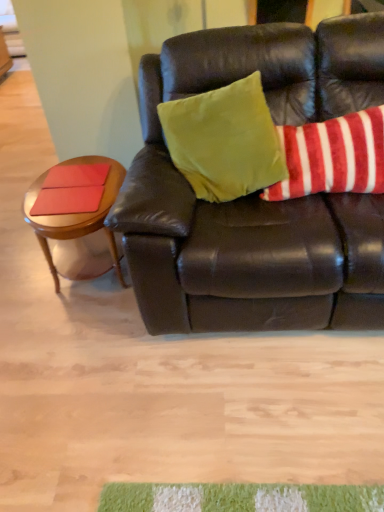
Measure the distance between matte red pad at left, the second pad from the bottom, and camera.

A distance of 6.28 feet exists between matte red pad at left, the second pad from the bottom, and camera.

What is the approximate width of matte brown leather couch at center?

matte brown leather couch at center is 1.05 meters in width.

What do you see at coordinates (225, 140) in the screenshot? This screenshot has height=512, width=384. I see `velvety green pillow at upper center, which is the first pillow in left-to-right order` at bounding box center [225, 140].

From the picture: What is the approximate width of woodenwoodentable at left?

woodenwoodentable at left is 18.40 inches wide.

Locate an element on the screen. Image resolution: width=384 pixels, height=512 pixels. matte red pad at left, the first pad positioned from the top is located at coordinates (76, 175).

From the image's perspective, is velvety green pillow at upper center, arranged as the second pillow when viewed from the right, over woodenwoodentable at left?

Indeed, from the image's perspective, velvety green pillow at upper center, arranged as the second pillow when viewed from the right, is shown above woodenwoodentable at left.

In terms of height, does velvety green pillow at upper center, arranged as the second pillow when viewed from the right, look taller or shorter compared to woodenwoodentable at left?

Considering their sizes, velvety green pillow at upper center, arranged as the second pillow when viewed from the right, has more height than woodenwoodentable at left.

Is the position of velvety green pillow at upper center, which is the first pillow in left-to-right order, less distant than that of woodenwoodentable at left?

Yes, velvety green pillow at upper center, which is the first pillow in left-to-right order, is closer to the camera.

From the image's perspective, which is above, velvety green pillow at upper center, arranged as the second pillow when viewed from the right, or matte red pad at left, the first pad positioned from the top?

velvety green pillow at upper center, arranged as the second pillow when viewed from the right, from the image's perspective.

Would you say velvety green pillow at upper center, which is the first pillow in left-to-right order, contains matte red pad at left, the second pad from the bottom?

No, matte red pad at left, the second pad from the bottom, is not inside velvety green pillow at upper center, which is the first pillow in left-to-right order.

The image size is (384, 512). I want to click on pillow that is the 2nd one when counting forward from the matte red pad at left, the first pad in the back-to-front sequence, so pos(225,140).

Is velvety green pillow at upper center, which is the first pillow in left-to-right order, positioned with its back to matte red pad at left, the second pad from the bottom?

No, velvety green pillow at upper center, which is the first pillow in left-to-right order, is not facing the opposite direction of matte red pad at left, the second pad from the bottom.

Who is shorter, matte red pad at left, the second pad viewed from the back, or matte red pad at left, which ranks as the second pad in front-to-back order?

Standing shorter between the two is matte red pad at left, which ranks as the second pad in front-to-back order.

Where is `pad behind the matte red pad at left, marked as the 1th pad in a bottom-to-top arrangement`? The width and height of the screenshot is (384, 512). pad behind the matte red pad at left, marked as the 1th pad in a bottom-to-top arrangement is located at coordinates (76, 175).

Is matte red pad at left, marked as the 1th pad in a bottom-to-top arrangement, wider than matte red pad at left, the second pad from the bottom?

Indeed, matte red pad at left, marked as the 1th pad in a bottom-to-top arrangement, has a greater width compared to matte red pad at left, the second pad from the bottom.

Is matte red pad at left, placed as the 1th pad when sorted from front to back, smaller than matte red pad at left, which ranks as the second pad in front-to-back order?

Actually, matte red pad at left, placed as the 1th pad when sorted from front to back, might be larger than matte red pad at left, which ranks as the second pad in front-to-back order.

In the scene shown: Is red/white striped pillow at upper right, the 1th pillow when ordered from right to left, placed right next to velvety green pillow at upper center, which is the first pillow in left-to-right order?

No, red/white striped pillow at upper right, the 1th pillow when ordered from right to left, is not next to velvety green pillow at upper center, which is the first pillow in left-to-right order.

Does point (340, 174) appear closer or farther from the camera than point (230, 186)?

Point (340, 174) is positioned closer to the camera compared to point (230, 186).

Considering the positions of objects red/white striped pillow at upper right, the 1th pillow when ordered from right to left, and velvety green pillow at upper center, which is the first pillow in left-to-right order, in the image provided, who is in front, red/white striped pillow at upper right, the 1th pillow when ordered from right to left, or velvety green pillow at upper center, which is the first pillow in left-to-right order,?

velvety green pillow at upper center, which is the first pillow in left-to-right order.

Could you tell me if matte red pad at left, placed as the 1th pad when sorted from front to back, is facing matte brown leather couch at center?

No, matte red pad at left, placed as the 1th pad when sorted from front to back, is not oriented towards matte brown leather couch at center.

Are matte red pad at left, placed as the 2th pad when sorted from top to bottom, and matte brown leather couch at center far apart?

No, matte red pad at left, placed as the 2th pad when sorted from top to bottom, is not far from matte brown leather couch at center.

From their relative heights in the image, would you say matte red pad at left, marked as the 1th pad in a bottom-to-top arrangement, is taller or shorter than matte brown leather couch at center?

matte red pad at left, marked as the 1th pad in a bottom-to-top arrangement, is shorter than matte brown leather couch at center.

Considering the relative positions of matte red pad at left, marked as the 1th pad in a bottom-to-top arrangement, and matte brown leather couch at center in the image provided, is matte red pad at left, marked as the 1th pad in a bottom-to-top arrangement, to the right of matte brown leather couch at center from the viewer's perspective?

In fact, matte red pad at left, marked as the 1th pad in a bottom-to-top arrangement, is to the left of matte brown leather couch at center.

Is red/white striped pillow at upper right, the second pillow when ordered from left to right, directly adjacent to matte brown leather couch at center?

red/white striped pillow at upper right, the second pillow when ordered from left to right, and matte brown leather couch at center are not in contact.

Based on the photo, considering the positions of objects red/white striped pillow at upper right, the 1th pillow when ordered from right to left, and matte brown leather couch at center in the image provided, who is more to the right, red/white striped pillow at upper right, the 1th pillow when ordered from right to left, or matte brown leather couch at center?

red/white striped pillow at upper right, the 1th pillow when ordered from right to left.

Image resolution: width=384 pixels, height=512 pixels. Identify the location of pillow on the right of matte brown leather couch at center. (333, 156).

From a real-world perspective, is red/white striped pillow at upper right, the second pillow when ordered from left to right, physically below matte brown leather couch at center?

Incorrect, from a real-world perspective, red/white striped pillow at upper right, the second pillow when ordered from left to right, is higher than matte brown leather couch at center.

Which object is positioned more to the right, matte brown leather couch at center or matte red pad at left, placed as the 1th pad when sorted from front to back?

From the viewer's perspective, matte brown leather couch at center appears more on the right side.

Is matte brown leather couch at center facing away from matte red pad at left, marked as the 1th pad in a bottom-to-top arrangement?

matte brown leather couch at center is not turned away from matte red pad at left, marked as the 1th pad in a bottom-to-top arrangement.

Does matte brown leather couch at center touch matte red pad at left, placed as the 1th pad when sorted from front to back?

There is a gap between matte brown leather couch at center and matte red pad at left, placed as the 1th pad when sorted from front to back.

At what (x,y) coordinates should I click in order to perform the action: click on studio couch on the right of matte red pad at left, placed as the 2th pad when sorted from top to bottom. Please return your answer as a coordinate pair (x, y). This screenshot has width=384, height=512. Looking at the image, I should click on (256, 193).

Which pillow is the 2nd one when counting from the front of the woodenwoodentable at left? Please provide its 2D coordinates.

[(225, 140)]

The height and width of the screenshot is (512, 384). Identify the location of pad that is the 1st one below the velvety green pillow at upper center, which is the first pillow in left-to-right order (from a real-world perspective). (76, 175).

From the image, which object appears to be farther from matte red pad at left, the first pad positioned from the top, woodenwoodentable at left or matte brown leather couch at center?

matte brown leather couch at center is positioned further to the anchor matte red pad at left, the first pad positioned from the top.

Based on their spatial positions, is matte red pad at left, the first pad in the back-to-front sequence, or matte brown leather couch at center further from woodenwoodentable at left?

matte brown leather couch at center is further to woodenwoodentable at left.

When comparing their distances from woodenwoodentable at left, does velvety green pillow at upper center, which is the first pillow in left-to-right order, or red/white striped pillow at upper right, the 1th pillow when ordered from right to left, seem closer?

Result: The object closer to woodenwoodentable at left is velvety green pillow at upper center, which is the first pillow in left-to-right order.

From the image, which object appears to be farther from matte brown leather couch at center, matte red pad at left, marked as the 1th pad in a bottom-to-top arrangement, or matte red pad at left, which ranks as the second pad in front-to-back order?

matte red pad at left, which ranks as the second pad in front-to-back order, is further to matte brown leather couch at center.

When comparing their distances from velvety green pillow at upper center, arranged as the second pillow when viewed from the right, does matte red pad at left, marked as the 1th pad in a bottom-to-top arrangement, or matte red pad at left, the second pad from the bottom, seem further?

The object further to velvety green pillow at upper center, arranged as the second pillow when viewed from the right, is matte red pad at left, the second pad from the bottom.

Considering their positions, is velvety green pillow at upper center, arranged as the second pillow when viewed from the right, positioned further to matte red pad at left, marked as the 1th pad in a bottom-to-top arrangement, than matte red pad at left, the second pad from the bottom?

velvety green pillow at upper center, arranged as the second pillow when viewed from the right.

Estimate the real-world distances between objects in this image. Which object is further from velvety green pillow at upper center, which is the first pillow in left-to-right order, woodenwoodentable at left or matte red pad at left, marked as the 1th pad in a bottom-to-top arrangement?

Among the two, matte red pad at left, marked as the 1th pad in a bottom-to-top arrangement, is located further to velvety green pillow at upper center, which is the first pillow in left-to-right order.

Looking at the image, which one is located further to matte brown leather couch at center, velvety green pillow at upper center, which is the first pillow in left-to-right order, or matte red pad at left, placed as the 1th pad when sorted from front to back?

Based on the image, matte red pad at left, placed as the 1th pad when sorted from front to back, appears to be further to matte brown leather couch at center.

At what (x,y) coordinates should I click in order to perform the action: click on pillow situated between matte red pad at left, the first pad in the back-to-front sequence, and matte brown leather couch at center from left to right. Please return your answer as a coordinate pair (x, y). The width and height of the screenshot is (384, 512). Looking at the image, I should click on (225, 140).

At what (x,y) coordinates should I click in order to perform the action: click on pillow between woodenwoodentable at left and matte brown leather couch at center from left to right. Please return your answer as a coordinate pair (x, y). Looking at the image, I should click on (225, 140).

At what (x,y) coordinates should I click in order to perform the action: click on table between matte red pad at left, which ranks as the second pad in front-to-back order, and matte brown leather couch at center from left to right. Please return your answer as a coordinate pair (x, y). The image size is (384, 512). Looking at the image, I should click on (76, 215).

At what (x,y) coordinates should I click in order to perform the action: click on table between matte red pad at left, the second pad viewed from the back, and red/white striped pillow at upper right, the 1th pillow when ordered from right to left. Please return your answer as a coordinate pair (x, y). Looking at the image, I should click on (76, 215).